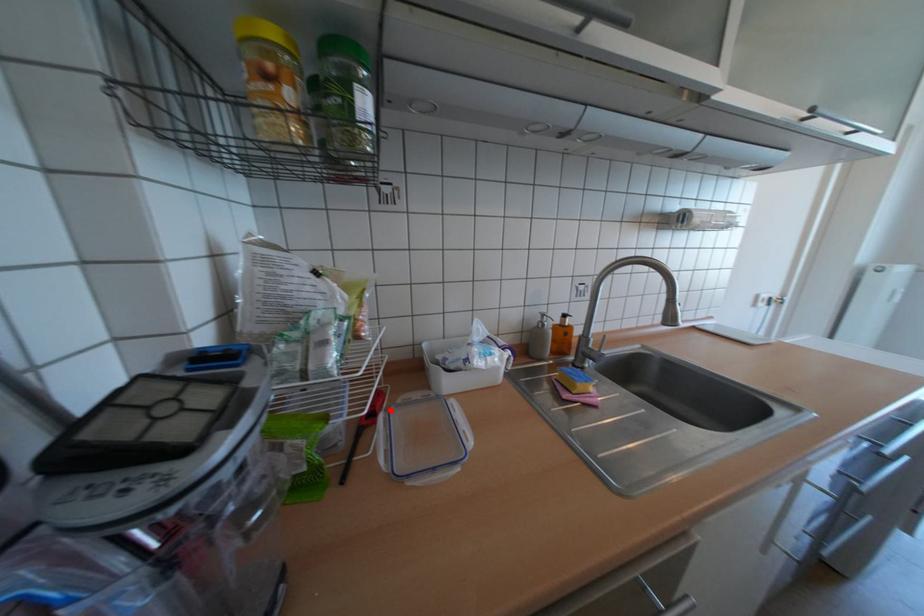
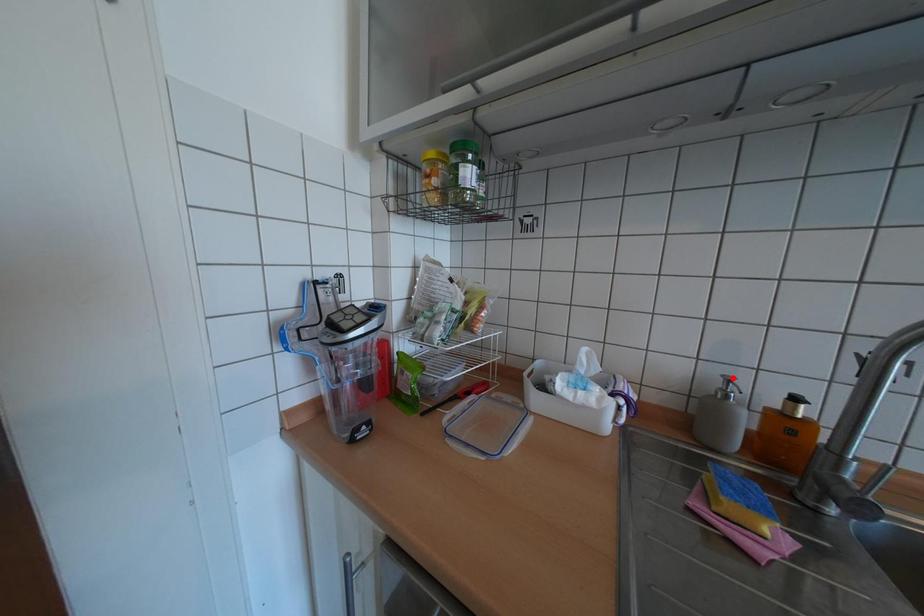
I am providing you with two images of the same scene from different viewpoints. A red point is marked on the first image and another point is marked on the second image. Do the highlighted points in image1 and image2 indicate the same real-world spot?

No